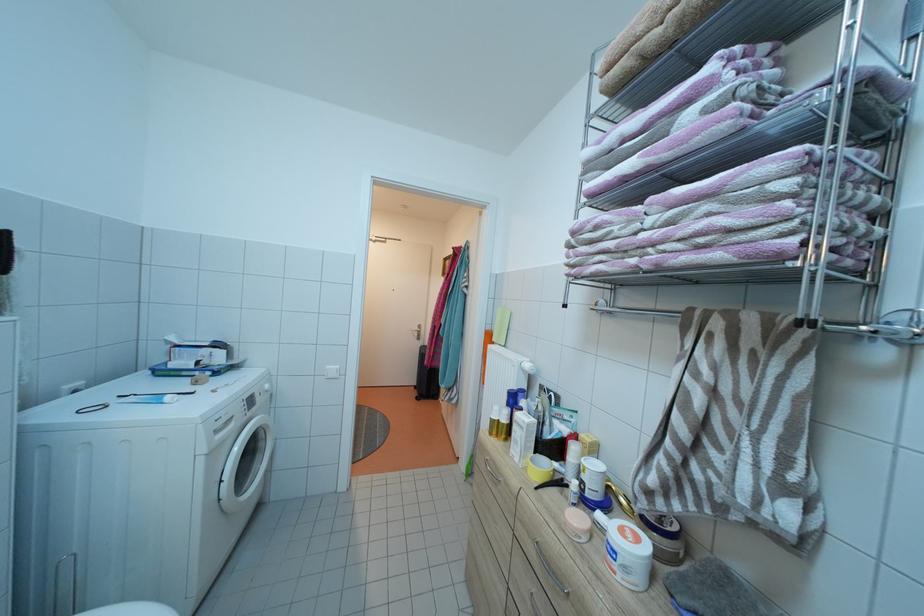
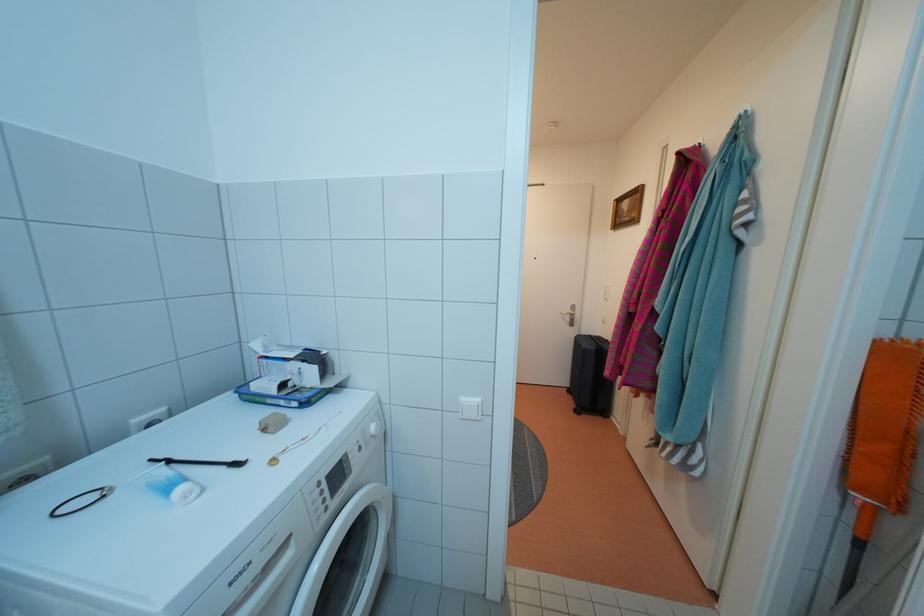
The point at (468,253) is marked in the first image. Where is the corresponding point in the second image?

(704, 153)